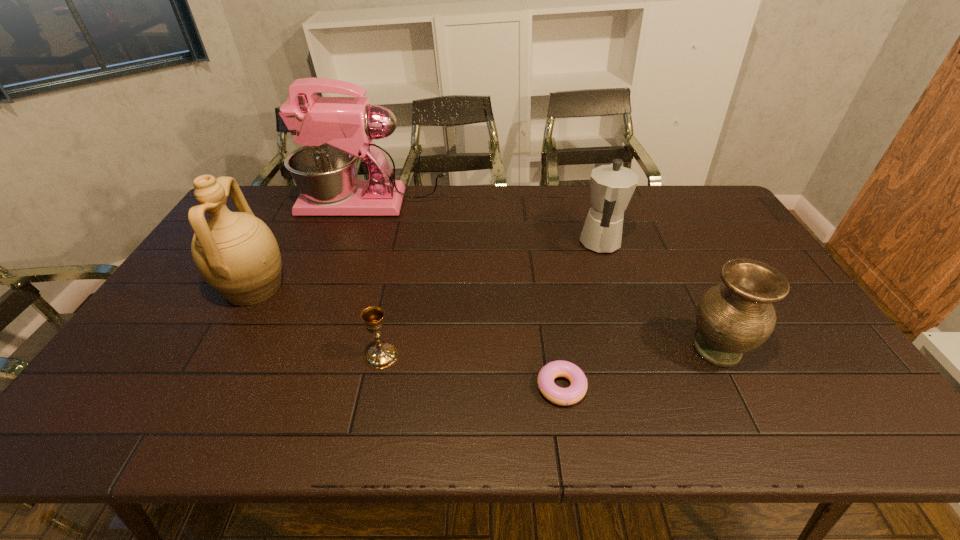
In order to click on object positioned at the left edge in this screenshot , I will do `click(236, 253)`.

Where is `free space at the far edge of the desktop`? This screenshot has width=960, height=540. free space at the far edge of the desktop is located at coordinates (659, 187).

The width and height of the screenshot is (960, 540). I want to click on vacant space at the near edge of the desktop, so (x=471, y=418).

Identify the location of vacant space at the left edge of the desktop. This screenshot has width=960, height=540. point(169,353).

This screenshot has width=960, height=540. Find the location of `vacant space at the right edge of the desktop`. vacant space at the right edge of the desktop is located at coordinates (836, 361).

At what (x,y) coordinates should I click in order to perform the action: click on free spot at the far left corner of the desktop. Please return your answer as a coordinate pair (x, y). Looking at the image, I should click on (276, 192).

Find the location of a particular element. free spot at the near right corner of the desktop is located at coordinates (874, 434).

You are a GUI agent. You are given a task and a screenshot of the screen. Output one action in this format:
    pyautogui.click(x=<x>, y=<y>)
    Task: Click on the vacant area that lies between the shortest object and the chalice
    The height and width of the screenshot is (540, 960).
    Given the screenshot: What is the action you would take?
    pyautogui.click(x=471, y=372)

I want to click on vacant space that's between the farthest object and the chalice, so click(377, 280).

At what (x,y) coordinates should I click in order to perform the action: click on free space between the third object from right to left and the tallest object. Please return your answer as a coordinate pair (x, y). This screenshot has height=540, width=960. Looking at the image, I should click on (468, 295).